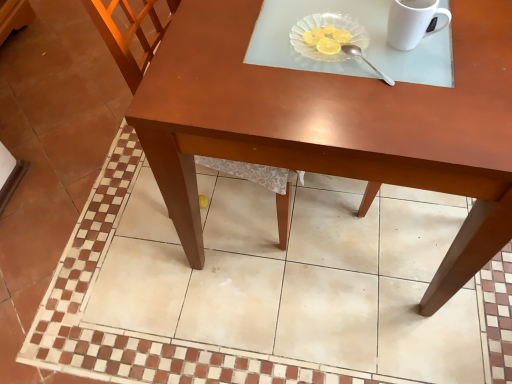
This screenshot has width=512, height=384. What are the coordinates of `free space between white glossy mug at upper right and silver metallic spoon at upper center` in the screenshot? It's located at (390, 57).